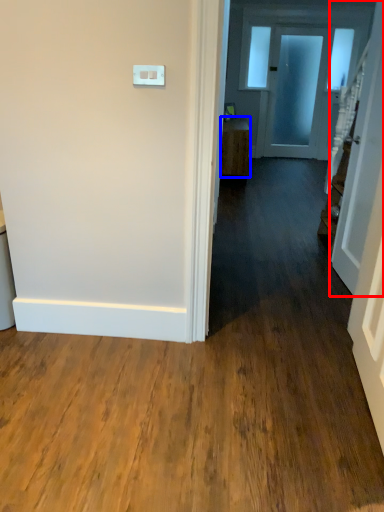
Question: Which object appears closest to the camera in this image, door (highlighted by a red box) or furniture (highlighted by a blue box)?

Choices:
 (A) door
 (B) furniture

Answer: (A)